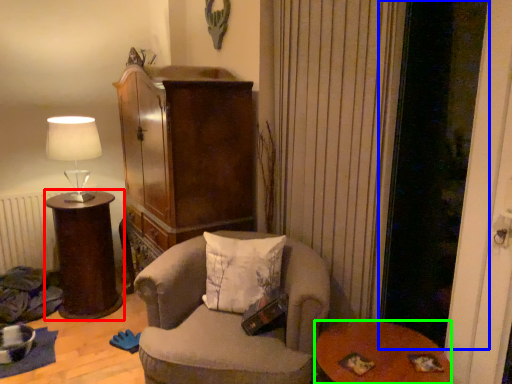
Question: Based on their relative distances, which object is nearer to desk (highlighted by a red box)? Choose from screen door (highlighted by a blue box) and table (highlighted by a green box).

Choices:
 (A) screen door
 (B) table

Answer: (B)